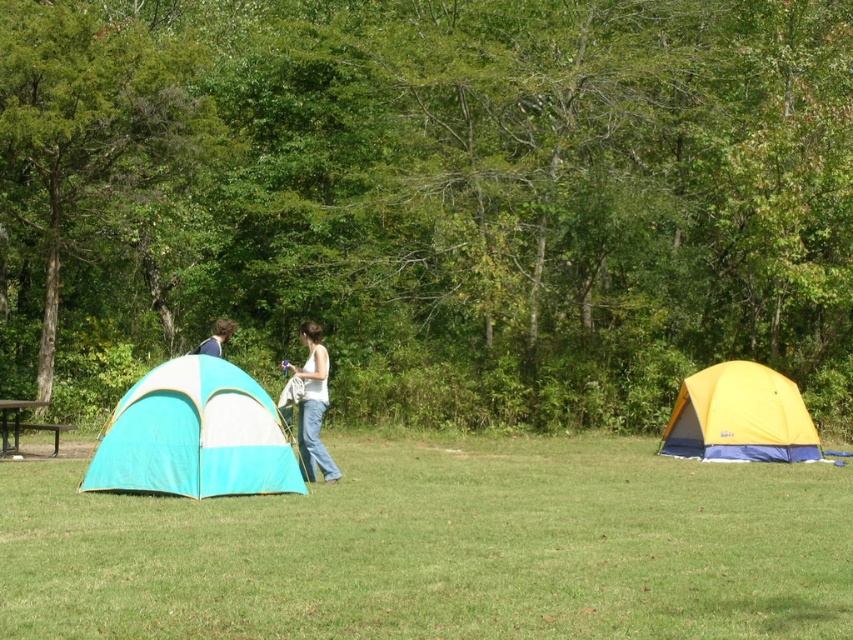
Question: Is green grass at center bigger than matte blue shirt at left?

Choices:
 (A) yes
 (B) no

Answer: (A)

Question: Can you confirm if teal fabric tent at left is thinner than matte blue shirt at left?

Choices:
 (A) yes
 (B) no

Answer: (A)

Question: Estimate the real-world distances between objects in this image. Which object is closer to the brushed metal picnic table at left?

Choices:
 (A) teal fabric tent at left
 (B) matte blue shirt at left

Answer: (B)

Question: Among these objects, which one is farthest from the camera?

Choices:
 (A) teal fabric tent at left
 (B) brushed metal picnic table at left
 (C) green grass at center
 (D) yellow fabric tent at right

Answer: (D)

Question: Considering the real-world distances, which object is farthest from the matte blue shirt at left?

Choices:
 (A) yellow fabric tent at right
 (B) green grass at center
 (C) brushed metal picnic table at left

Answer: (A)

Question: Does white cotton tank top at center appear on the right side of matte blue shirt at left?

Choices:
 (A) yes
 (B) no

Answer: (A)